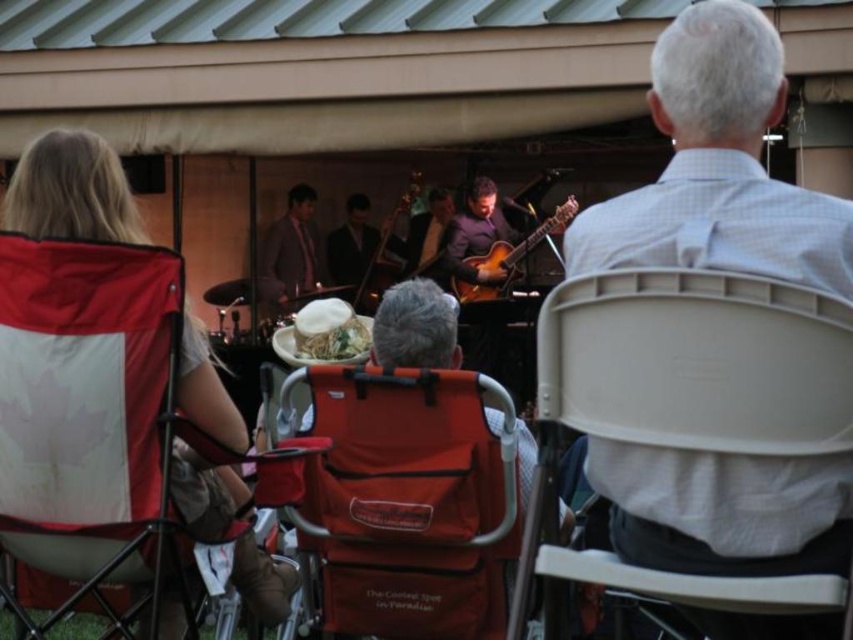
Question: Estimate the real-world distances between objects in this image. Which object is closer to the white paper plate at center?

Choices:
 (A) matte red folding chair at center
 (B) red fabric chair at left

Answer: (B)

Question: Can you confirm if white plastic chair at right is thinner than shiny brown suit at center?

Choices:
 (A) yes
 (B) no

Answer: (B)

Question: From the image, what is the correct spatial relationship of red fabric chair at left in relation to glossy wood guitar at center?

Choices:
 (A) left
 (B) right

Answer: (A)

Question: Which point is farther to the camera?

Choices:
 (A) tap(502, 241)
 (B) tap(276, 252)
 (C) tap(567, 364)
 (D) tap(260, 589)

Answer: (B)

Question: Observing the image, what is the correct spatial positioning of matte red folding chair at center in reference to glossy wood guitar at center?

Choices:
 (A) above
 (B) below

Answer: (B)

Question: Which object appears closest to the camera in this image?

Choices:
 (A) matte red folding chair at center
 (B) wooden upright bass at center
 (C) shiny brown suit at center
 (D) red fabric chair at left

Answer: (A)